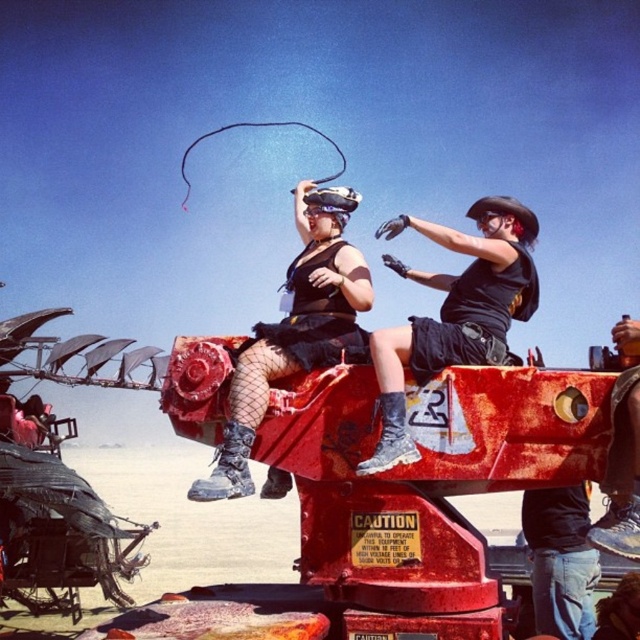
You are an attendee at the festival and need to choose a helmet to protect yourself from the sun. The black matte helmet at upper right and the matte black helmet at center are available. Which one offers more coverage due to its size?

The black matte helmet at upper right has a larger size compared to the matte black helmet at center, so it offers more coverage for sun protection.